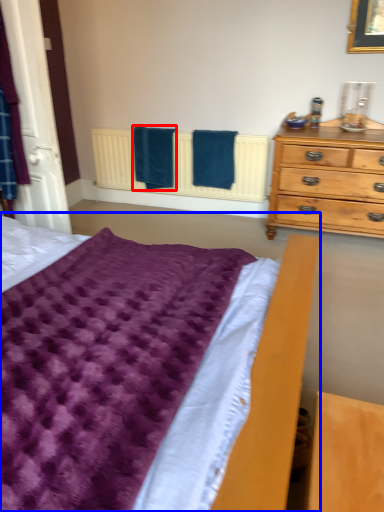
Question: Which of the following is the closest to the observer, bath towel (highlighted by a red box) or bed (highlighted by a blue box)?

Choices:
 (A) bath towel
 (B) bed

Answer: (B)